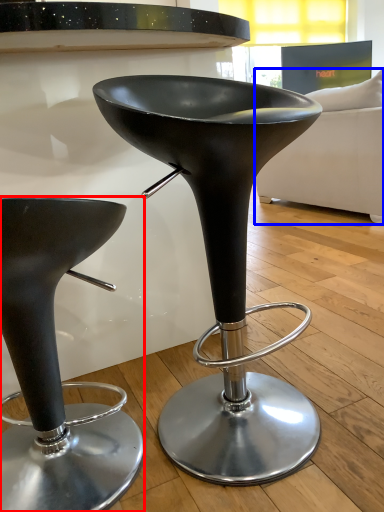
Question: Which object is closer to the camera taking this photo, stool (highlighted by a red box) or couch (highlighted by a blue box)?

Choices:
 (A) stool
 (B) couch

Answer: (A)